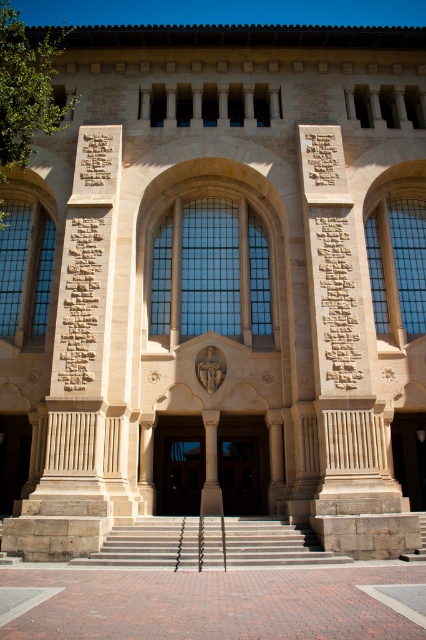
Question: Which object is the closest to the clear glass window at left?

Choices:
 (A) black stone inscription at center
 (B) clear glass window at upper right
 (C) carved stone inscription at center
 (D) light gray concrete stairs at center

Answer: (C)

Question: Which object is the farthest from the light gray concrete stairs at center?

Choices:
 (A) clear glass window at center
 (B) carved stone inscription at center

Answer: (B)

Question: Is clear glass window at center thinner than black stone inscription at center?

Choices:
 (A) yes
 (B) no

Answer: (B)

Question: Can you confirm if clear glass window at center is wider than light gray concrete stairs at center?

Choices:
 (A) no
 (B) yes

Answer: (A)

Question: Which point is closer to the camera?

Choices:
 (A) (391, 243)
 (B) (109, 157)
 (C) (181, 554)
 (D) (28, 257)

Answer: (C)

Question: Can you confirm if clear glass window at left is positioned below carved stone inscription at center?

Choices:
 (A) yes
 (B) no

Answer: (A)